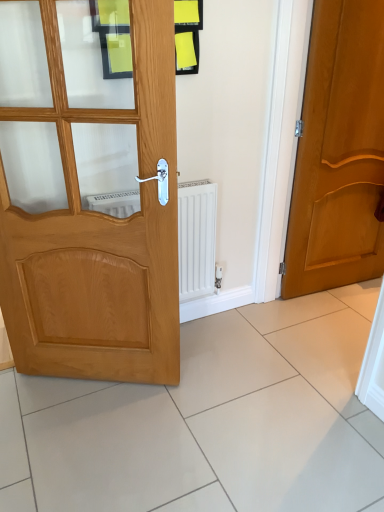
Question: Is white glossy tile at lower right positioned beyond the bounds of matte wood door at right, which is counted as the second door, starting from the left?

Choices:
 (A) yes
 (B) no

Answer: (A)

Question: From a real-world perspective, is white glossy tile at lower right physically above matte wood door at right, marked as the 2th door in a front-to-back arrangement?

Choices:
 (A) no
 (B) yes

Answer: (A)

Question: Can you confirm if white glossy tile at lower right is bigger than matte wood door at right, marked as the 2th door in a front-to-back arrangement?

Choices:
 (A) no
 (B) yes

Answer: (A)

Question: Is white glossy tile at lower right oriented away from matte wood door at right, acting as the 1th door starting from the back?

Choices:
 (A) yes
 (B) no

Answer: (B)

Question: Considering the relative sizes of white glossy tile at lower right and matte wood door at right, marked as the 2th door in a front-to-back arrangement, in the image provided, is white glossy tile at lower right thinner than matte wood door at right, marked as the 2th door in a front-to-back arrangement,?

Choices:
 (A) no
 (B) yes

Answer: (A)

Question: From the image's perspective, is white glossy tile at lower right located above or below matte wood door at right, which is counted as the second door, starting from the left?

Choices:
 (A) above
 (B) below

Answer: (B)

Question: From their relative heights in the image, would you say white glossy tile at lower right is taller or shorter than matte wood door at right, which is counted as the second door, starting from the left?

Choices:
 (A) tall
 (B) short

Answer: (B)

Question: Is white glossy tile at lower right in front of or behind matte wood door at right, acting as the 1th door starting from the back, in the image?

Choices:
 (A) behind
 (B) front

Answer: (A)

Question: From a real-world perspective, relative to matte wood door at right, which is counted as the 1th door, starting from the right, is white glossy tile at lower right vertically above or below?

Choices:
 (A) below
 (B) above

Answer: (A)

Question: From the image's perspective, is light brown wood door at left, which ranks as the second door in back-to-front order, located above or below matte wood door at right, marked as the 2th door in a front-to-back arrangement?

Choices:
 (A) above
 (B) below

Answer: (B)

Question: Considering the positions of light brown wood door at left, placed as the second door when sorted from right to left, and matte wood door at right, marked as the 2th door in a front-to-back arrangement, in the image, is light brown wood door at left, placed as the second door when sorted from right to left, taller or shorter than matte wood door at right, marked as the 2th door in a front-to-back arrangement,?

Choices:
 (A) tall
 (B) short

Answer: (B)

Question: In the image, is light brown wood door at left, which ranks as the second door in back-to-front order, on the left side or the right side of matte wood door at right, which is counted as the second door, starting from the left?

Choices:
 (A) left
 (B) right

Answer: (A)

Question: Does point (79, 108) appear closer or farther from the camera than point (304, 163)?

Choices:
 (A) closer
 (B) farther

Answer: (A)

Question: Choose the correct answer: Is light brown wood door at left, the first door viewed from the left, inside white glossy tile at lower right or outside it?

Choices:
 (A) outside
 (B) inside

Answer: (A)

Question: Is point (59, 353) closer or farther from the camera than point (344, 404)?

Choices:
 (A) farther
 (B) closer

Answer: (A)